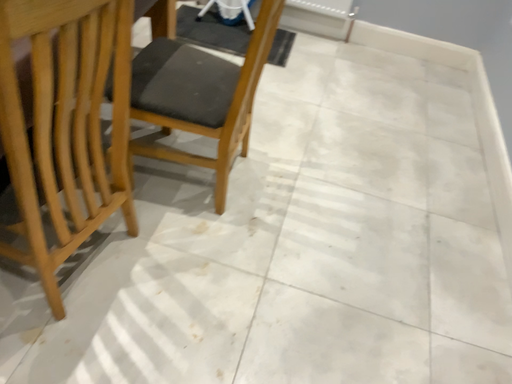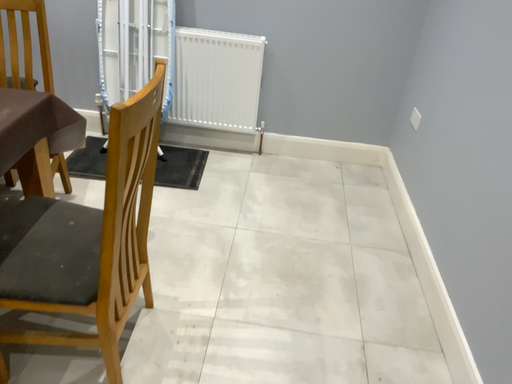
Question: How did the camera likely rotate when shooting the video?

Choices:
 (A) rotated upward
 (B) rotated downward

Answer: (A)